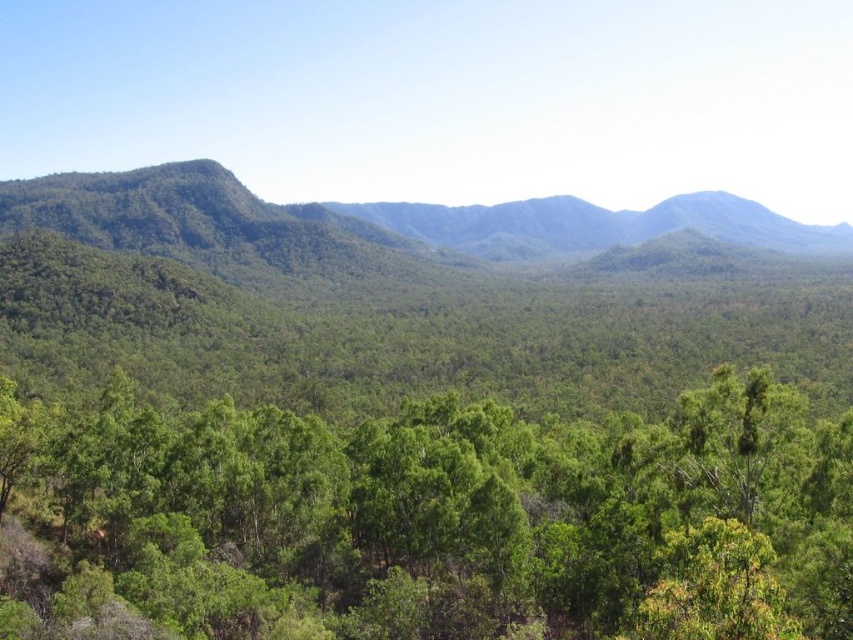
Between point (733, 608) and point (341, 384), which one is positioned in front?

Point (733, 608) is more forward.

Is point (77, 424) in front of point (625, 376)?

Yes, point (77, 424) is closer to viewer.

Locate an element on the screen. This screenshot has height=640, width=853. green leafy tree at center is located at coordinates (427, 520).

Where is `green leafy tree at center`? The height and width of the screenshot is (640, 853). green leafy tree at center is located at coordinates (427, 520).